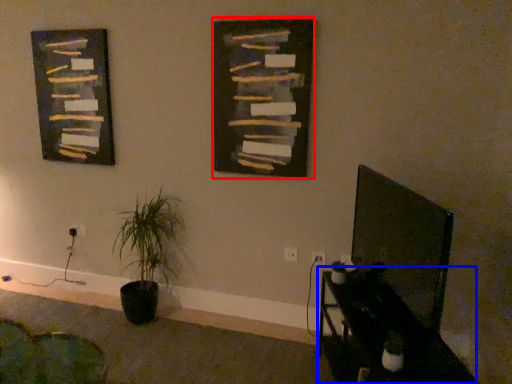
Question: Which object is closer to the camera taking this photo, bulletin board (highlighted by a red box) or table (highlighted by a blue box)?

Choices:
 (A) bulletin board
 (B) table

Answer: (B)